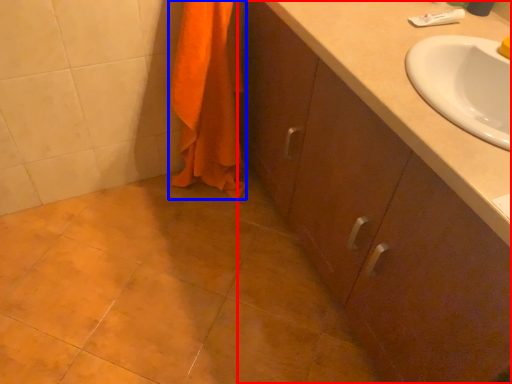
Question: Which of the following is the farthest to the observer, bathroom cabinet (highlighted by a red box) or bath towel (highlighted by a blue box)?

Choices:
 (A) bathroom cabinet
 (B) bath towel

Answer: (B)